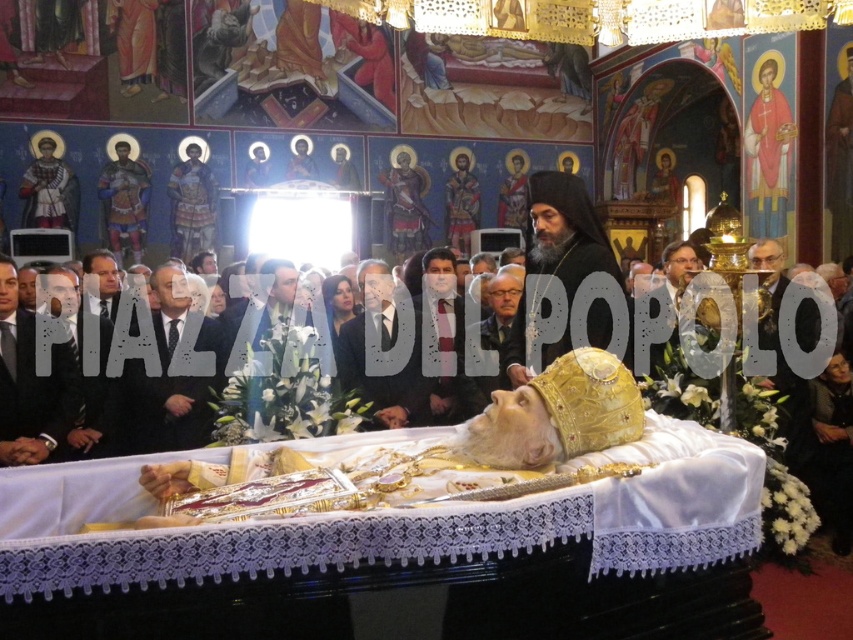
Between gold textured crown at center and black suit at center, which one has more height?

With more height is gold textured crown at center.

Between gold textured crown at center and black suit at center, which one is positioned lower?

black suit at center is below.

The height and width of the screenshot is (640, 853). What do you see at coordinates (566, 230) in the screenshot? I see `gold textured crown at center` at bounding box center [566, 230].

Find the location of a particular element. The width and height of the screenshot is (853, 640). gold textured crown at center is located at coordinates (566, 230).

Can you confirm if black suit at left is smaller than gray hair at center?

No.

Who is taller, black suit at left or gray hair at center?

With more height is black suit at left.

Where is `black suit at left`? Image resolution: width=853 pixels, height=640 pixels. black suit at left is located at coordinates (86, 376).

Is black suit at center shorter than gray hair at center?

Correct, black suit at center is not as tall as gray hair at center.

Does black suit at center appear on the left side of gray hair at center?

Correct, you'll find black suit at center to the left of gray hair at center.

Is point (213, 349) positioned behind point (505, 376)?

That is True.

Where is `black suit at center`? black suit at center is located at coordinates (172, 376).